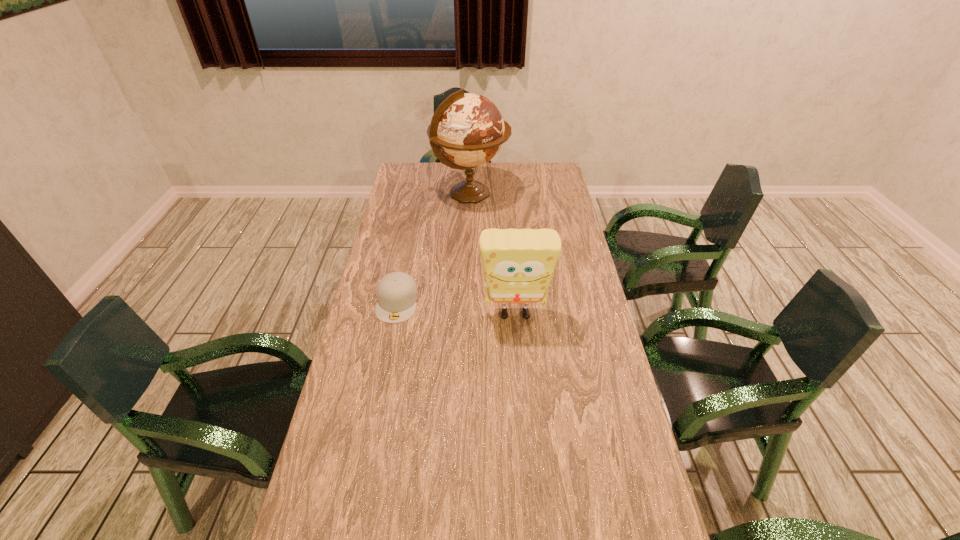
Identify the location of object that is the closest to the tallest object. This screenshot has height=540, width=960. pyautogui.click(x=397, y=294).

Identify the location of vacant position in the image that satisfies the following two spatial constraints: 1. on the front of the globe showing Asia; 2. on the front-facing side of the cap. (468, 302).

This screenshot has height=540, width=960. I want to click on free point that satisfies the following two spatial constraints: 1. on the front of the tallest object showing Asia; 2. on the front-facing side of the cap, so click(468, 302).

Where is `vacant space that satisfies the following two spatial constraints: 1. on the front of the globe showing Asia; 2. on the front-facing side of the cap`? This screenshot has height=540, width=960. vacant space that satisfies the following two spatial constraints: 1. on the front of the globe showing Asia; 2. on the front-facing side of the cap is located at coordinates (468, 302).